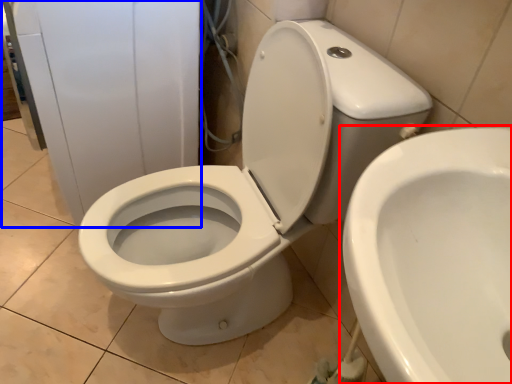
Question: Which object is further to the camera taking this photo, toilet (highlighted by a red box) or porcelain (highlighted by a blue box)?

Choices:
 (A) toilet
 (B) porcelain

Answer: (B)